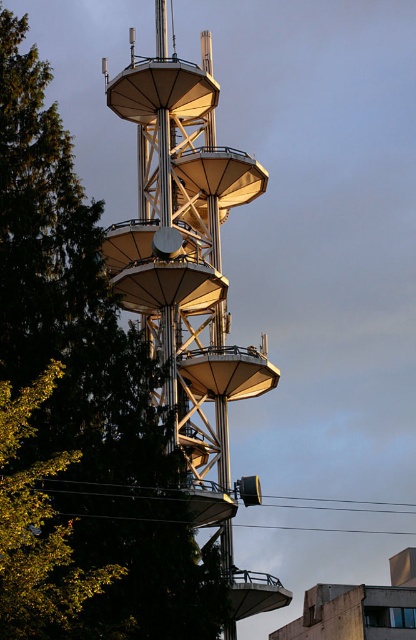
You are a photographer planning to capture the metallic silver tower at center from the left side of the green leafy tree at left. Will the tree block your view of the tower?

The green leafy tree at left is positioned under the metallic silver tower at center, so the tree will not block your view of the tower as it is located below it.

You are a photographer planning to capture the metallic silver tower at center and the green leafy tree at left in a single frame. Based on their sizes, which object should appear larger in your photo?

The metallic silver tower at center should appear larger in the photo since it is bigger than the green leafy tree at left.

You are a photographer planning to capture the metallic silver tower at center and the green leafy tree at left in a single frame. Based on their widths, which object should you focus on to ensure both fit in the frame without cropping?

The green leafy tree at left might be wider than metallic silver tower at center, so to ensure both fit in the frame without cropping, you should focus on the wider object, which is the green leafy tree at left.